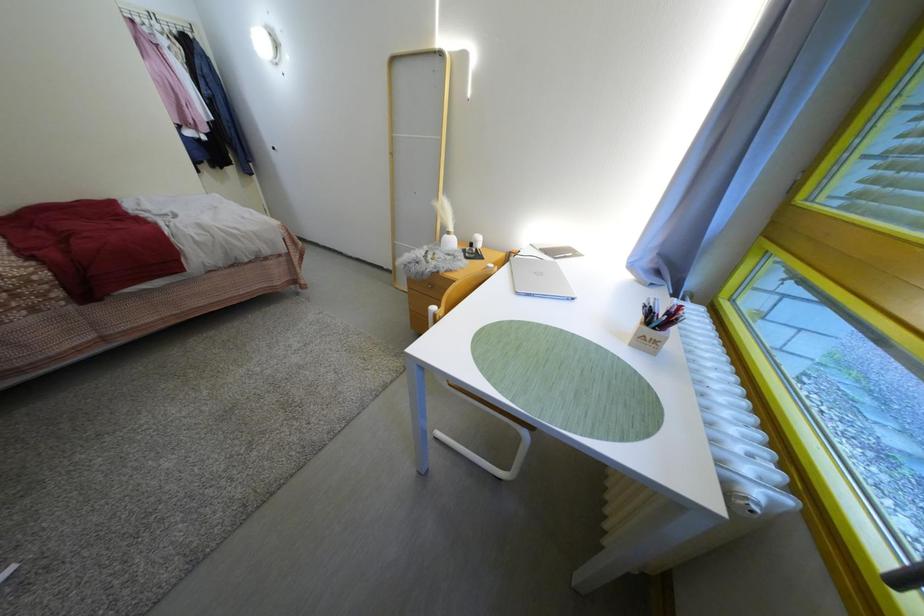
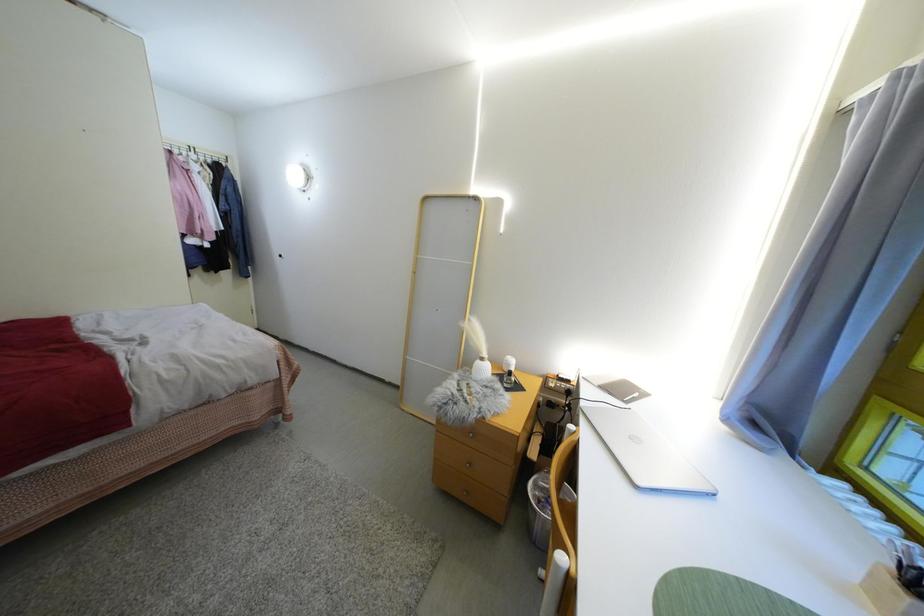
What movement of the cameraman would produce the second image?

The cameraman moved toward left, forward.